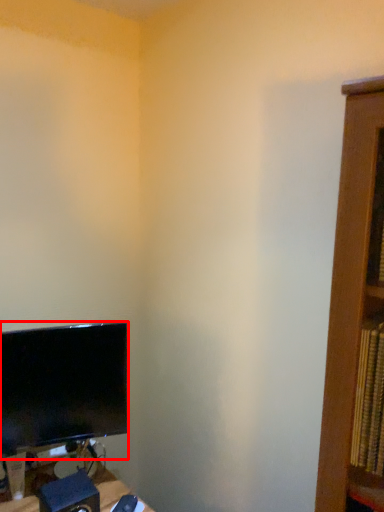
Question: Considering the relative positions of computer monitor (annotated by the red box) and speaker in the image provided, where is computer monitor (annotated by the red box) located with respect to the staircase?

Choices:
 (A) right
 (B) left

Answer: (B)